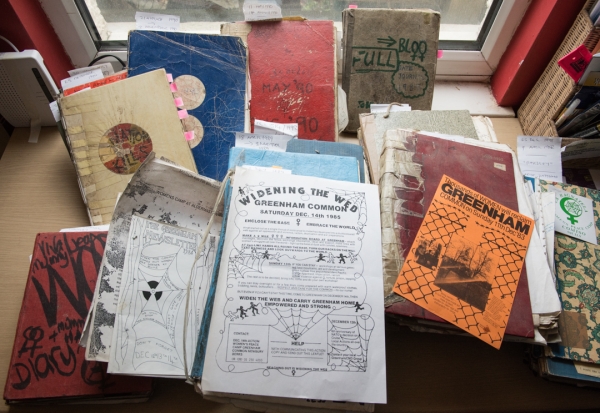
The image size is (600, 413). I want to click on desk with a light beige wooden appearance, so click(x=55, y=195).